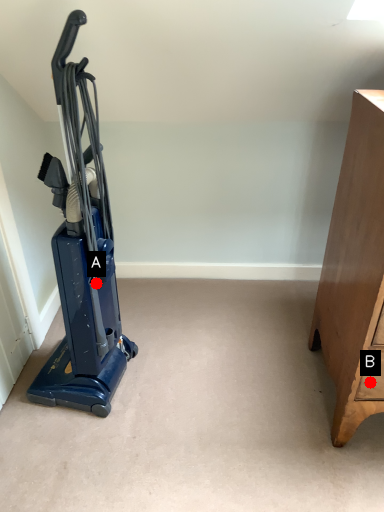
Question: Two points are circled on the image, labeled by A and B beside each circle. Which point appears farthest from the camera in this image?

Choices:
 (A) A is further
 (B) B is further

Answer: (A)